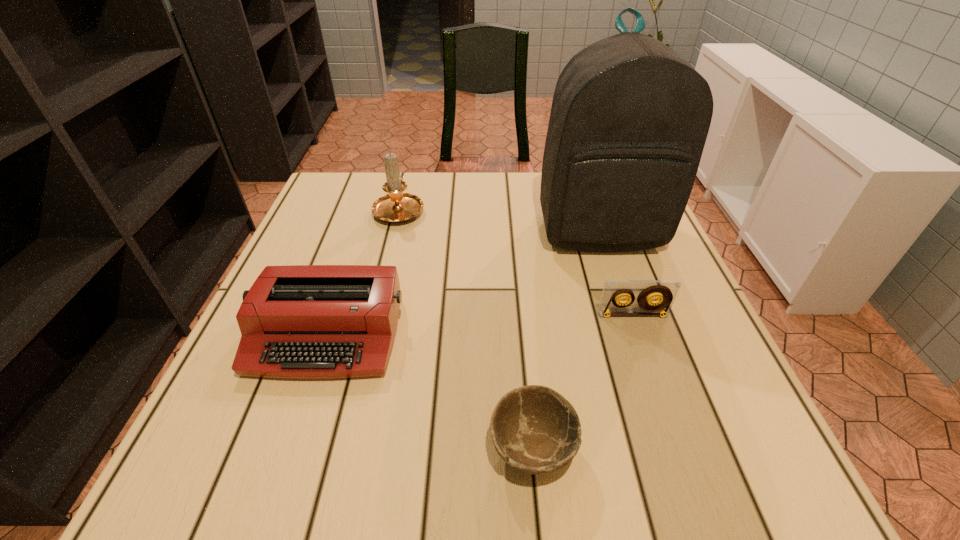
The image size is (960, 540). In order to click on free space at the near edge in this screenshot , I will do `click(337, 471)`.

The height and width of the screenshot is (540, 960). In order to click on vacant space at the left edge of the desktop in this screenshot , I will do `click(332, 240)`.

The image size is (960, 540). In the image, there is a desktop. What are the coordinates of `vacant space at the right edge` in the screenshot? It's located at (665, 262).

The width and height of the screenshot is (960, 540). In the image, there is a desktop. What are the coordinates of `vacant space at the far left corner` in the screenshot? It's located at (356, 178).

Locate an element on the screen. The width and height of the screenshot is (960, 540). vacant space at the near left corner of the desktop is located at coordinates (190, 466).

The width and height of the screenshot is (960, 540). I want to click on free space at the near right corner of the desktop, so click(x=743, y=494).

At what (x,y) coordinates should I click in order to perform the action: click on free space between the typewriter and the tallest object. Please return your answer as a coordinate pair (x, y). This screenshot has height=540, width=960. Looking at the image, I should click on (463, 284).

Find the location of a particular element. The width and height of the screenshot is (960, 540). free space between the videotape and the bowl is located at coordinates (583, 382).

The width and height of the screenshot is (960, 540). Identify the location of free point between the typewriter and the third object from right to left. (429, 392).

Locate an element on the screen. The image size is (960, 540). free spot between the typewriter and the bowl is located at coordinates (429, 392).